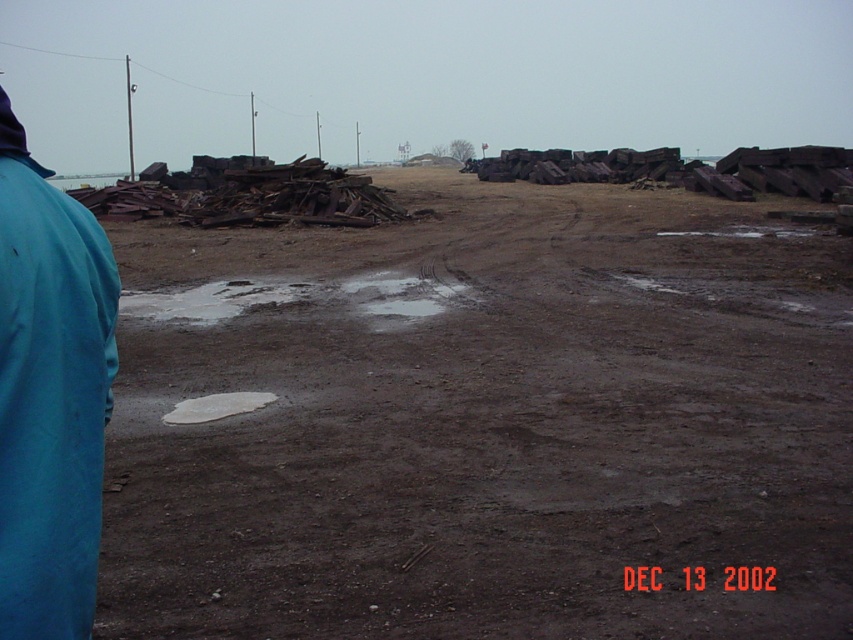
Question: Is brown dirt field at center wider than rusty metal debris at center?

Choices:
 (A) no
 (B) yes

Answer: (B)

Question: Is blue fabric jacket at left further to camera compared to white matte puddle at center?

Choices:
 (A) no
 (B) yes

Answer: (A)

Question: Which of the following is the closest to the observer?

Choices:
 (A) rusty metal debris at center
 (B) white matte puddle at center
 (C) brown dirt field at center

Answer: (C)

Question: Among these objects, which one is nearest to the camera?

Choices:
 (A) blue fabric jacket at left
 (B) white matte puddle at center

Answer: (A)

Question: Among these points, which one is farthest from the camera?

Choices:
 (A) (384, 212)
 (B) (94, 243)
 (C) (207, 413)

Answer: (A)

Question: Does rusty metal debris at center appear on the left side of white matte puddle at center?

Choices:
 (A) no
 (B) yes

Answer: (B)